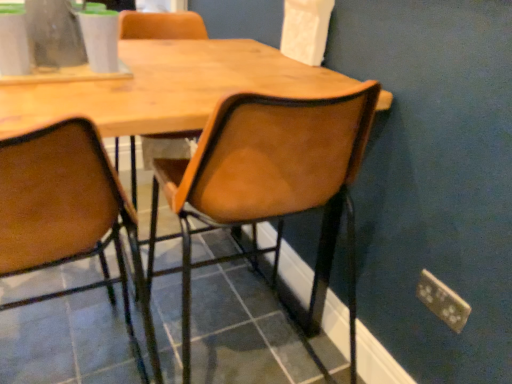
This screenshot has height=384, width=512. I want to click on brown leather chair at center, the second chair positioned from the right, so click(x=67, y=215).

In order to face brown leather chair at center, the second chair positioned from the right, should I rotate leftwards or rightwards?

Turn left by 26.410 degrees to look at brown leather chair at center, the second chair positioned from the right.

What do you see at coordinates (54, 34) in the screenshot? Image resolution: width=512 pixels, height=384 pixels. I see `clear glass vase at upper left` at bounding box center [54, 34].

Image resolution: width=512 pixels, height=384 pixels. Describe the element at coordinates (442, 301) in the screenshot. I see `metallic gold power plugs and sockets at lower right` at that location.

What do you see at coordinates (270, 186) in the screenshot?
I see `leather-like brown chair at center, the second chair viewed from the left` at bounding box center [270, 186].

At what (x,y) coordinates should I click in order to perform the action: click on brown leather chair at center, the second chair positioned from the right. Please return your answer as a coordinate pair (x, y). This screenshot has width=512, height=384. Looking at the image, I should click on (67, 215).

Considering the relative sizes of leather-like brown chair at center, the second chair viewed from the left, and clear glass vase at upper left in the image provided, is leather-like brown chair at center, the second chair viewed from the left, taller than clear glass vase at upper left?

Yes, leather-like brown chair at center, the second chair viewed from the left, is taller than clear glass vase at upper left.

Is clear glass vase at upper left at the back of leather-like brown chair at center, the second chair viewed from the left?

No, clear glass vase at upper left is not at the back of leather-like brown chair at center, the second chair viewed from the left.

Which of these two, leather-like brown chair at center, which is the 1th chair in right-to-left order, or clear glass vase at upper left, is wider?

leather-like brown chair at center, which is the 1th chair in right-to-left order, is wider.

How far apart are leather-like brown chair at center, which is the 1th chair in right-to-left order, and clear glass vase at upper left?

leather-like brown chair at center, which is the 1th chair in right-to-left order, and clear glass vase at upper left are 37.65 inches apart from each other.

Is clear glass vase at upper left located outside metallic gold power plugs and sockets at lower right?

Yes, clear glass vase at upper left is located beyond the bounds of metallic gold power plugs and sockets at lower right.

Considering the sizes of objects clear glass vase at upper left and metallic gold power plugs and sockets at lower right in the image provided, who is smaller, clear glass vase at upper left or metallic gold power plugs and sockets at lower right?

metallic gold power plugs and sockets at lower right is smaller.

Can you confirm if clear glass vase at upper left is thinner than metallic gold power plugs and sockets at lower right?

No, clear glass vase at upper left is not thinner than metallic gold power plugs and sockets at lower right.

From the image's perspective, which is below, clear glass vase at upper left or metallic gold power plugs and sockets at lower right?

metallic gold power plugs and sockets at lower right.

Is white matte cup at upper center located outside clear glass vase at upper left?

Yes, white matte cup at upper center is not within clear glass vase at upper left.

Is white matte cup at upper center not near clear glass vase at upper left?

They are positioned close to each other.

In order to click on coffee cup that is below the clear glass vase at upper left (from the image's perspective) in this screenshot , I will do `click(100, 41)`.

What's the angular difference between white matte cup at upper center and clear glass vase at upper left's facing directions?

The angular difference between white matte cup at upper center and clear glass vase at upper left is 1.24 degrees.

Could you tell me if brown leather chair at center, which ranks as the first chair in left-to-right order, is facing clear glass vase at upper left?

No, brown leather chair at center, which ranks as the first chair in left-to-right order, is not facing towards clear glass vase at upper left.

From the image's perspective, is brown leather chair at center, which ranks as the first chair in left-to-right order, positioned above or below clear glass vase at upper left?

Based on their image positions, brown leather chair at center, which ranks as the first chair in left-to-right order, is located beneath clear glass vase at upper left.

In the image, is brown leather chair at center, the second chair positioned from the right, on the left side or the right side of clear glass vase at upper left?

In the image, brown leather chair at center, the second chair positioned from the right, appears on the right side of clear glass vase at upper left.

Is clear glass vase at upper left inside brown leather chair at center, the second chair positioned from the right?

No, brown leather chair at center, the second chair positioned from the right, does not contain clear glass vase at upper left.

Which is in front, metallic gold power plugs and sockets at lower right or white matte cup at upper center?

Positioned in front is white matte cup at upper center.

Is metallic gold power plugs and sockets at lower right looking in the opposite direction of white matte cup at upper center?

That's not correct — metallic gold power plugs and sockets at lower right is not looking away from white matte cup at upper center.

Could you measure the distance between metallic gold power plugs and sockets at lower right and white matte cup at upper center?

The distance of metallic gold power plugs and sockets at lower right from white matte cup at upper center is 38.43 inches.

From the image's perspective, which one is positioned higher, metallic gold power plugs and sockets at lower right or white matte cup at upper center?

white matte cup at upper center appears higher in the image.

From the picture: From the image's perspective, who appears lower, clear glass vase at upper left or white matte cup at upper center?

white matte cup at upper center appears lower in the image.

Considering the relative sizes of clear glass vase at upper left and white matte cup at upper center in the image provided, is clear glass vase at upper left taller than white matte cup at upper center?

Yes.

In the scene shown: What's the angular difference between clear glass vase at upper left and white matte cup at upper center's facing directions?

1.24 degrees.

Is metallic gold power plugs and sockets at lower right not within clear glass vase at upper left?

metallic gold power plugs and sockets at lower right lies outside clear glass vase at upper left's area.

Which object is positioned more to the left, metallic gold power plugs and sockets at lower right or clear glass vase at upper left?

clear glass vase at upper left is more to the left.

Find the location of `power plugs and sockets lying behind the clear glass vase at upper left`. power plugs and sockets lying behind the clear glass vase at upper left is located at coordinates (442, 301).

Who is bigger, metallic gold power plugs and sockets at lower right or clear glass vase at upper left?

clear glass vase at upper left is bigger.

You are a GUI agent. You are given a task and a screenshot of the screen. Output one action in this format:
    pyautogui.click(x=<x>, y=<y>)
    Task: Click on the 1st chair below the clear glass vase at upper left (from a real-world perspective)
    This screenshot has height=384, width=512.
    Given the screenshot: What is the action you would take?
    pyautogui.click(x=270, y=186)

Locate an element on the screen. The height and width of the screenshot is (384, 512). vase above the metallic gold power plugs and sockets at lower right (from a real-world perspective) is located at coordinates (54, 34).

Looking at the image, which one is located further to leather-like brown chair at center, the second chair viewed from the left, brown leather chair at center, the second chair positioned from the right, or metallic gold power plugs and sockets at lower right?

metallic gold power plugs and sockets at lower right is further to leather-like brown chair at center, the second chair viewed from the left.

Estimate the real-world distances between objects in this image. Which object is closer to white matte cup at upper center, leather-like brown chair at center, the second chair viewed from the left, or clear glass vase at upper left?

clear glass vase at upper left is closer to white matte cup at upper center.

When comparing their distances from metallic gold power plugs and sockets at lower right, does brown leather chair at center, which ranks as the first chair in left-to-right order, or white matte cup at upper center seem further?

white matte cup at upper center is positioned further to the anchor metallic gold power plugs and sockets at lower right.

Estimate the real-world distances between objects in this image. Which object is further from metallic gold power plugs and sockets at lower right, leather-like brown chair at center, the second chair viewed from the left, or brown leather chair at center, the second chair positioned from the right?

brown leather chair at center, the second chair positioned from the right, is further to metallic gold power plugs and sockets at lower right.

Based on their spatial positions, is white matte cup at upper center or brown leather chair at center, which ranks as the first chair in left-to-right order, closer to metallic gold power plugs and sockets at lower right?

brown leather chair at center, which ranks as the first chair in left-to-right order.

Looking at the image, which one is located further to metallic gold power plugs and sockets at lower right, white matte cup at upper center or leather-like brown chair at center, which is the 1th chair in right-to-left order?

white matte cup at upper center.

Based on the photo, looking at the image, which one is located further to metallic gold power plugs and sockets at lower right, clear glass vase at upper left or brown leather chair at center, which ranks as the first chair in left-to-right order?

clear glass vase at upper left.

From the picture: Which object lies nearer to the anchor point clear glass vase at upper left, leather-like brown chair at center, which is the 1th chair in right-to-left order, or white matte cup at upper center?

The object closer to clear glass vase at upper left is white matte cup at upper center.

The width and height of the screenshot is (512, 384). Find the location of `coffee cup between clear glass vase at upper left and leather-like brown chair at center, which is the 1th chair in right-to-left order, in the up-down direction`. coffee cup between clear glass vase at upper left and leather-like brown chair at center, which is the 1th chair in right-to-left order, in the up-down direction is located at coordinates (100, 41).

The width and height of the screenshot is (512, 384). Identify the location of chair between white matte cup at upper center and metallic gold power plugs and sockets at lower right from left to right. (270, 186).

The image size is (512, 384). What are the coordinates of `coffee cup between brown leather chair at center, the second chair positioned from the right, and metallic gold power plugs and sockets at lower right, in the horizontal direction` in the screenshot? It's located at (100, 41).

I want to click on coffee cup between clear glass vase at upper left and metallic gold power plugs and sockets at lower right in the horizontal direction, so click(x=100, y=41).